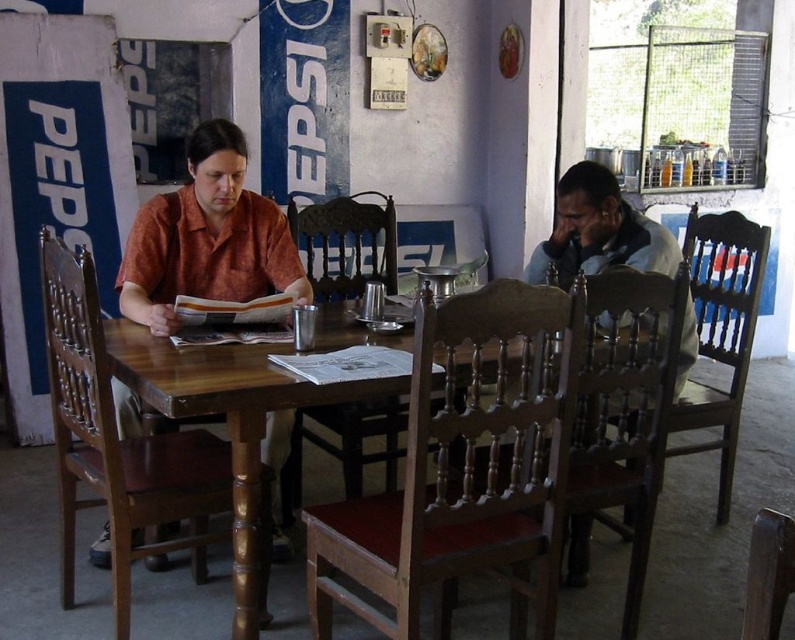
You are standing at the point labeled point (x=351, y=202) and want to walk to the point labeled point (x=584, y=355). Based on the scene description, will you have to walk towards the dining table or away from it?

Since point (x=584, y=355) is in front of point (x=351, y=202), you would need to walk towards the dining table to reach it.

You are a guest at this dining table and need to choose a chair to sit. The brown wooden chair at right and the wooden chair at center are available. Which chair is taller?

The brown wooden chair at right is taller than the wooden chair at center.